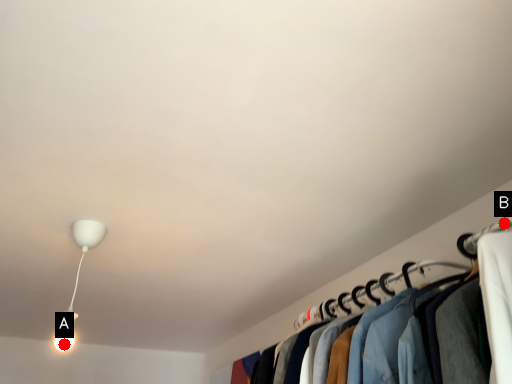
Question: Two points are circled on the image, labeled by A and B beside each circle. Which point is closer to the camera?

Choices:
 (A) A is closer
 (B) B is closer

Answer: (B)